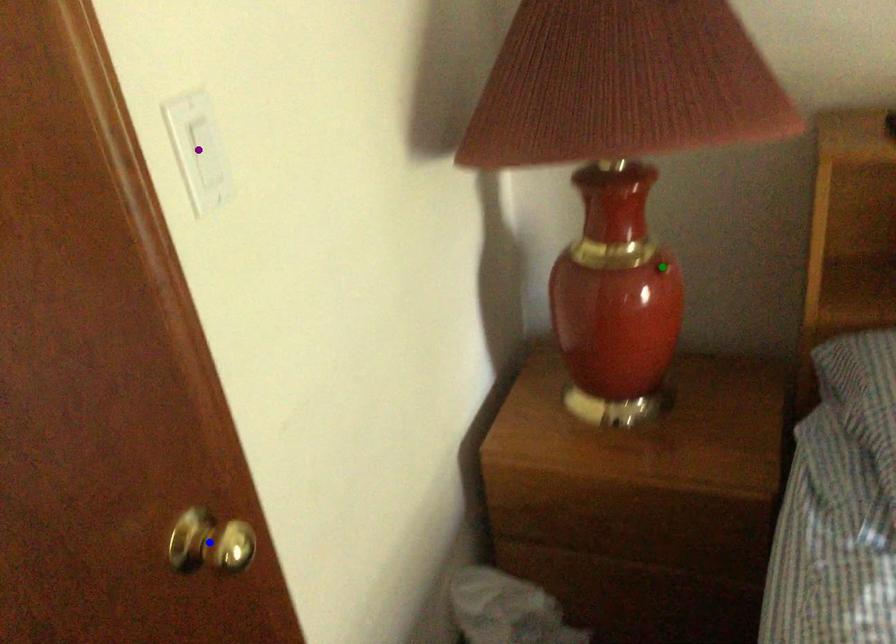
Order these from farthest to nearest:
purple point, green point, blue point

green point → purple point → blue point